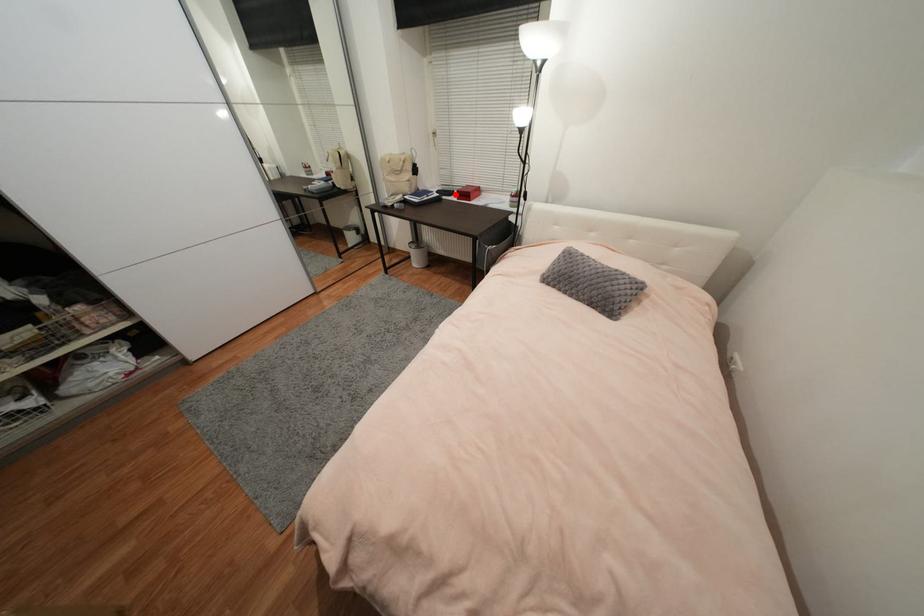
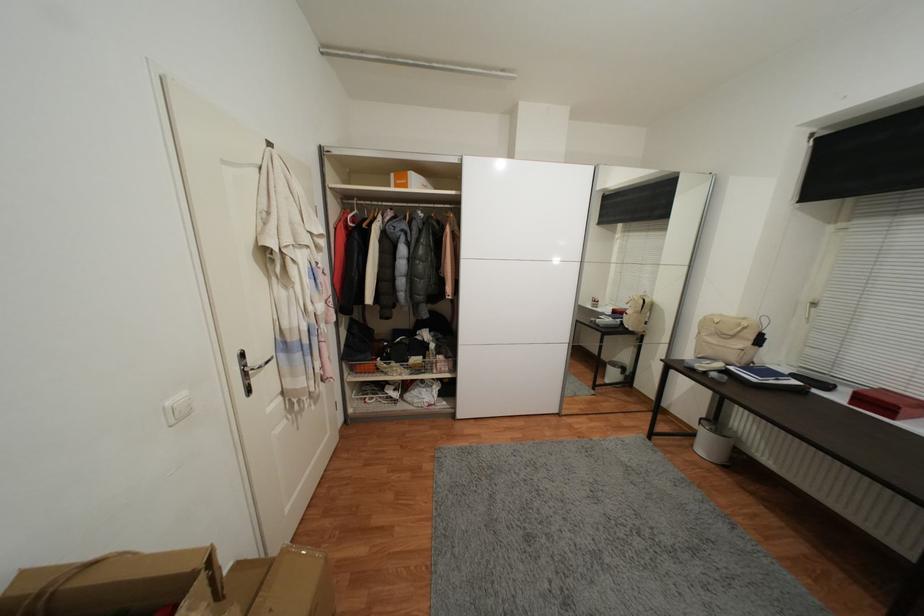
Question: I am providing you with two images of the same scene from different viewpoints. In image1, a red point is highlighted. Considering the same 3D point in image2, which of the following is correct?

Choices:
 (A) It is closer
 (B) It is farther

Answer: (B)